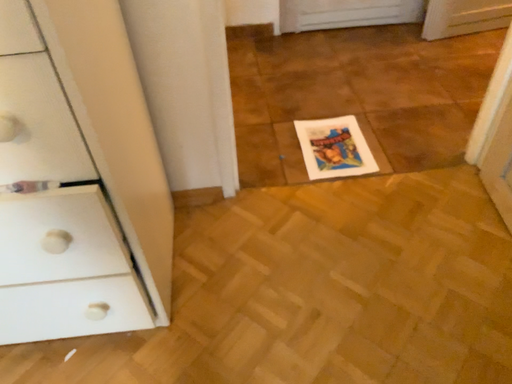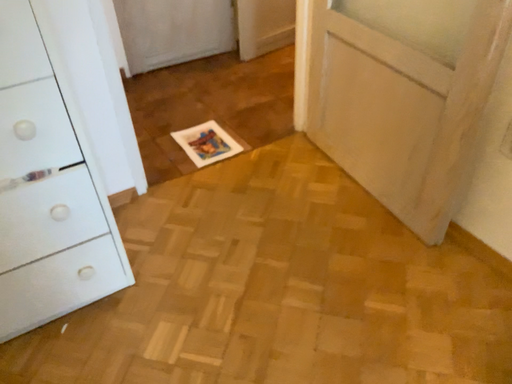
Question: Which way did the camera rotate in the video?

Choices:
 (A) rotated right
 (B) rotated left

Answer: (A)